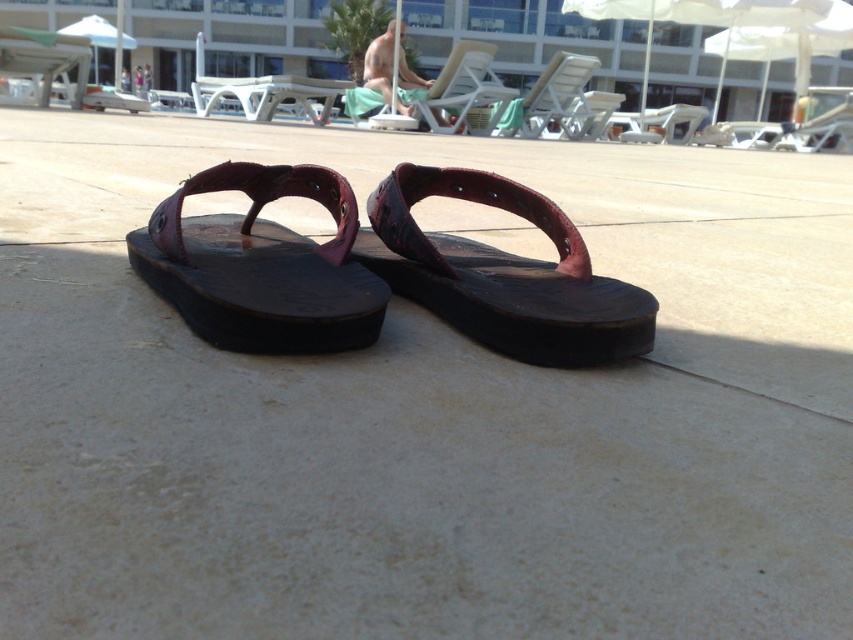
Which is behind, point (285, 234) or point (495, 188)?

The point (285, 234) is more distant.

Measure the distance between leather-like dark brown sandal at center and shiny leather sandal at center.

leather-like dark brown sandal at center is 7.40 inches away from shiny leather sandal at center.

At what (x,y) coordinates should I click in order to perform the action: click on leather-like dark brown sandal at center. Please return your answer as a coordinate pair (x, y). Image resolution: width=853 pixels, height=640 pixels. Looking at the image, I should click on (260, 266).

Between leather-like dark brown sandal at center and naked man at center, which one appears on the left side from the viewer's perspective?

naked man at center is more to the left.

Is point (202, 259) positioned after point (409, 112)?

No, it is not.

This screenshot has width=853, height=640. What are the coordinates of `leather-like dark brown sandal at center` in the screenshot? It's located at (260, 266).

Identify the location of shiny leather sandal at center. (502, 273).

Does shiny leather sandal at center appear on the right side of naked man at center?

Yes, shiny leather sandal at center is to the right of naked man at center.

You are a GUI agent. You are given a task and a screenshot of the screen. Output one action in this format:
    pyautogui.click(x=<x>, y=<y>)
    Task: Click on the shiny leather sandal at center
    This screenshot has width=853, height=640.
    Given the screenshot: What is the action you would take?
    pyautogui.click(x=502, y=273)